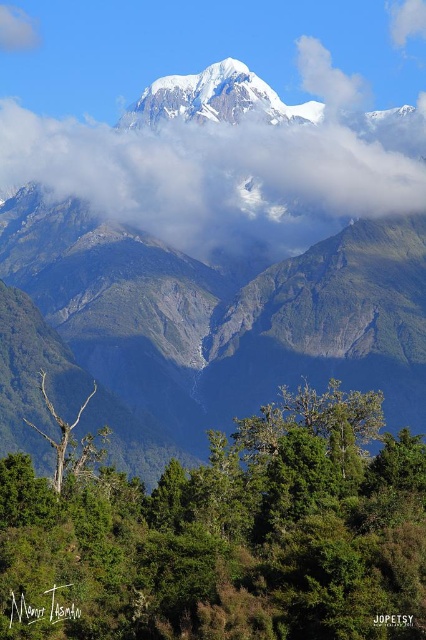
You are standing in the dense forest of the mountain landscape. You notice a green leafy tree at lower center and a bare wood tree at lower left. Which tree is closer to you?

The green leafy tree at lower center is closer to you because it is positioned under the bare wood tree at lower left, meaning it is in a lower layer of the image.